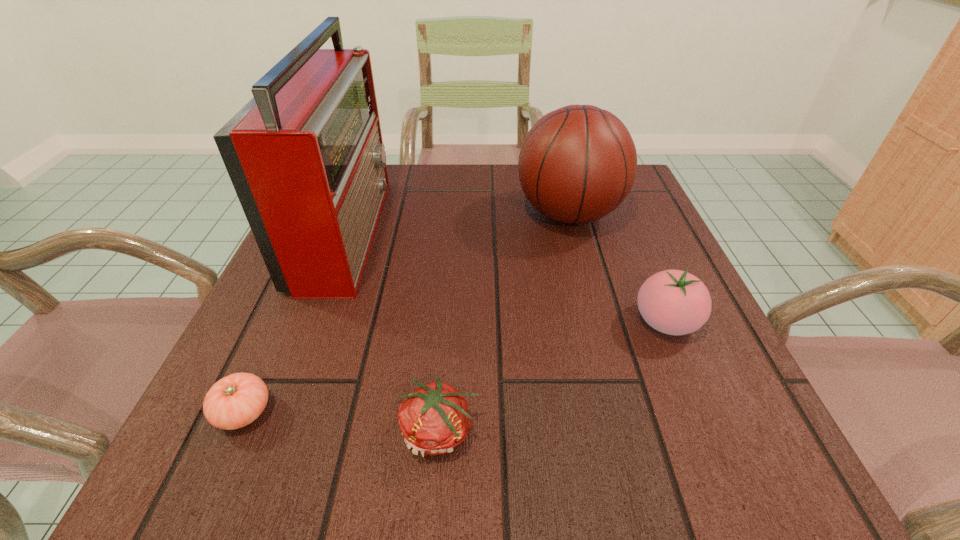
Find the location of a particular element. object situated at the near left corner is located at coordinates (234, 401).

Identify the location of object located in the far right corner section of the desktop. coord(577,164).

You are a GUI agent. You are given a task and a screenshot of the screen. Output one action in this format:
    pyautogui.click(x=<x>, y=<y>)
    Task: Click on the vacant space at the far edge of the desktop
    This screenshot has width=960, height=540.
    Given the screenshot: What is the action you would take?
    pyautogui.click(x=452, y=163)

Find the location of a particular element. free space at the near edge of the desktop is located at coordinates (357, 441).

The image size is (960, 540). In order to click on vacant space at the left edge of the desktop in this screenshot , I will do `click(246, 332)`.

The width and height of the screenshot is (960, 540). In the image, there is a desktop. In order to click on vacant space at the right edge in this screenshot , I will do `click(654, 393)`.

The image size is (960, 540). What are the coordinates of `vacant space at the near left corner of the desktop` in the screenshot? It's located at (247, 430).

This screenshot has width=960, height=540. Find the location of `vacant space at the far right corner of the desktop`. vacant space at the far right corner of the desktop is located at coordinates (651, 205).

In the image, there is a desktop. Where is `free region at the near right corner`? The image size is (960, 540). free region at the near right corner is located at coordinates (701, 487).

This screenshot has width=960, height=540. Find the location of `free space between the second tomato from left to right and the shortest tomato`. free space between the second tomato from left to right and the shortest tomato is located at coordinates (342, 422).